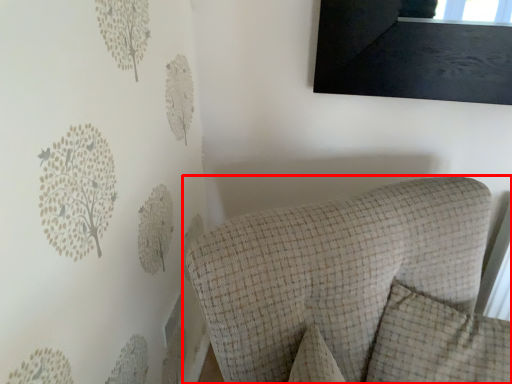
Question: In this image, where is furniture (annotated by the red box) located relative to pillow?

Choices:
 (A) right
 (B) left

Answer: (B)